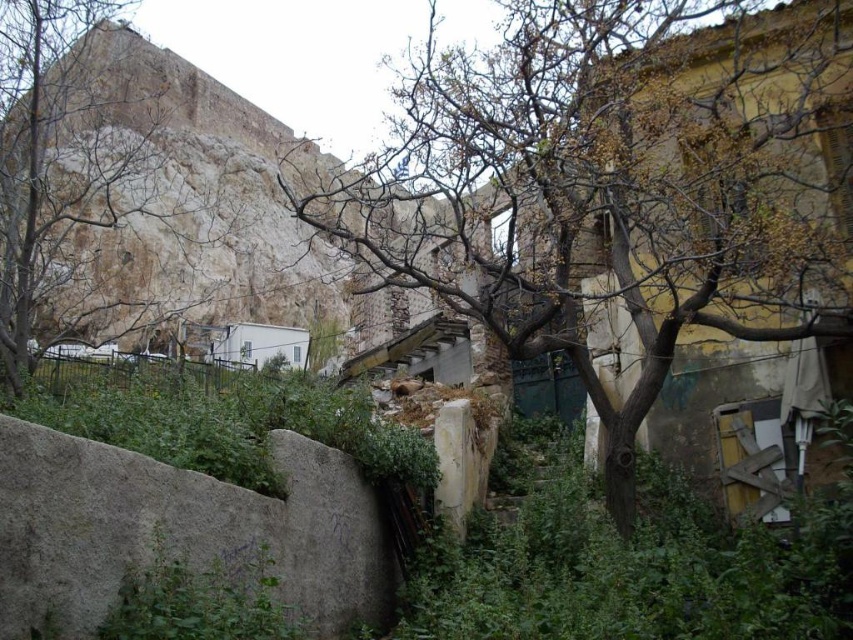
Who is higher up, brown rough bark tree at center or gray rough stone at lower left?

brown rough bark tree at center is higher up.

Is point (675, 52) more distant than point (48, 602)?

Yes, point (675, 52) is behind point (48, 602).

Does point (762, 109) lie in front of point (44, 524)?

No, it is behind (44, 524).

You are a GUI agent. You are given a task and a screenshot of the screen. Output one action in this format:
    pyautogui.click(x=<x>, y=<y>)
    Task: Click on the brown rough bark tree at center
    
    Given the screenshot: What is the action you would take?
    pyautogui.click(x=611, y=184)

Is brown rough bark tree at center closer to camera compared to rustic stone mountain at upper left?

Yes, it is.

Is brown rough bark tree at center thinner than rustic stone mountain at upper left?

Yes, brown rough bark tree at center is thinner than rustic stone mountain at upper left.

Is point (692, 108) less distant than point (1, 252)?

Yes, point (692, 108) is in front of point (1, 252).

Where is `brown rough bark tree at center`? brown rough bark tree at center is located at coordinates (611, 184).

Who is higher up, rustic stone mountain at upper left or gray rough stone at lower left?

rustic stone mountain at upper left is higher up.

Which is below, rustic stone mountain at upper left or gray rough stone at lower left?

gray rough stone at lower left is lower down.

The image size is (853, 640). What are the coordinates of `rustic stone mountain at upper left` in the screenshot? It's located at pyautogui.click(x=149, y=200).

Where is `rustic stone mountain at upper left`? The width and height of the screenshot is (853, 640). rustic stone mountain at upper left is located at coordinates (149, 200).